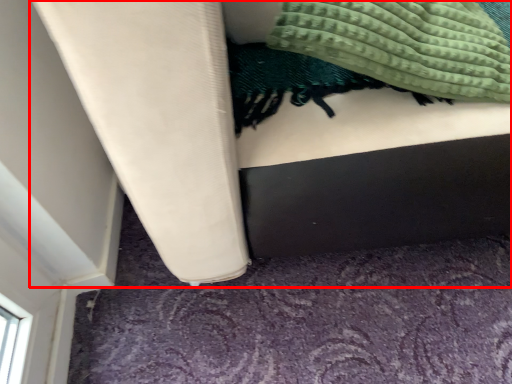
Question: From the image's perspective, what is the correct spatial relationship of furniture (annotated by the red box) in relation to blanket?

Choices:
 (A) below
 (B) above

Answer: (B)